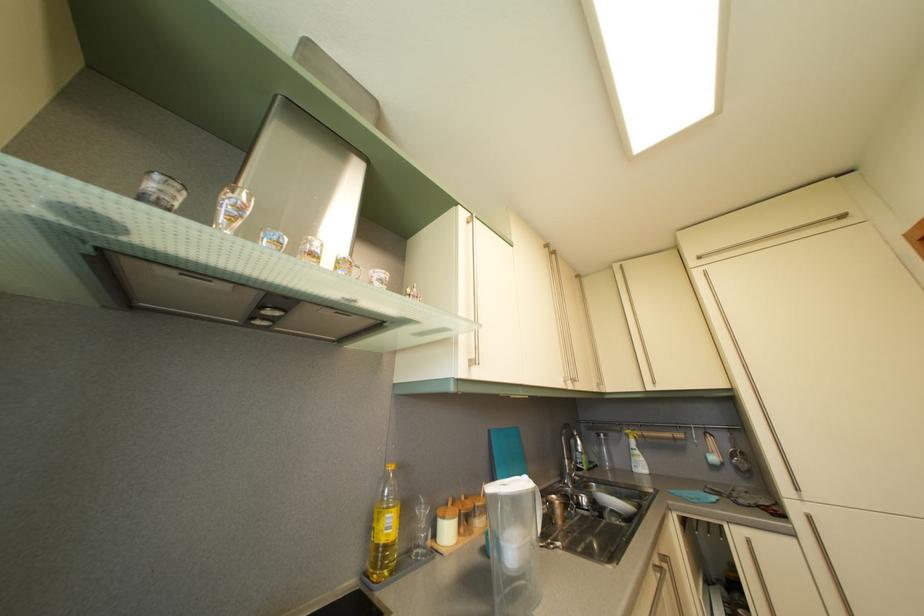
Find where to lift the faucet handle. Please return your answer as a coordinate pair (x, y).

(572, 454)